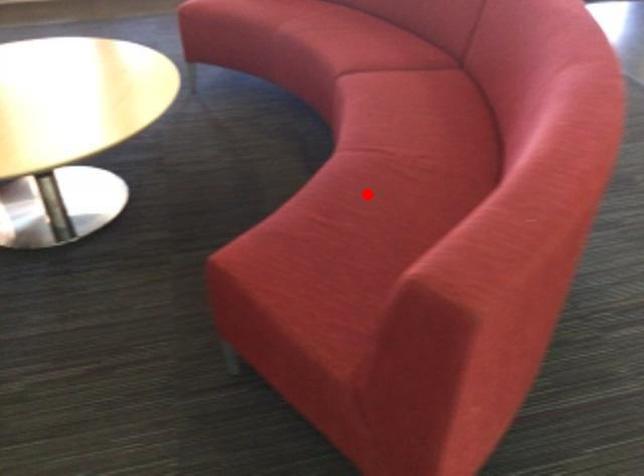
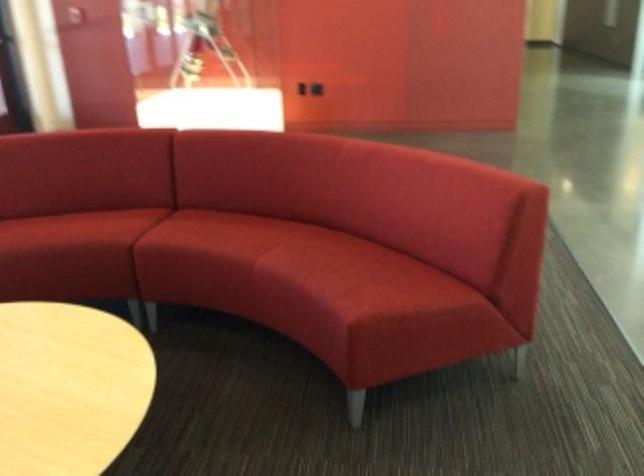
Where in the second image is the point corresponding to the highlighted location from the first image?

(328, 258)